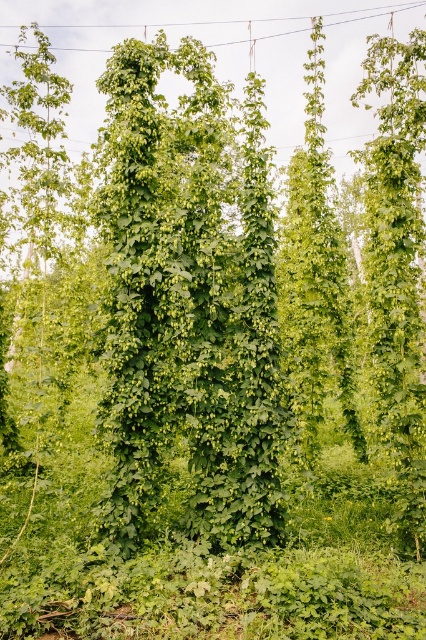
Question: Which of the following is the farthest from the observer?

Choices:
 (A) (236, 518)
 (B) (121, 24)

Answer: (B)

Question: Which object is closer to the camera taking this photo?

Choices:
 (A) green leafy plant at center
 (B) metallic wire at upper center

Answer: (A)

Question: Does green leafy plant at center appear on the right side of metallic wire at upper center?

Choices:
 (A) no
 (B) yes

Answer: (A)

Question: Which of the following is the closest to the observer?

Choices:
 (A) green leafy plant at center
 (B) metallic wire at upper center

Answer: (A)

Question: Does green leafy plant at center appear on the right side of metallic wire at upper center?

Choices:
 (A) no
 (B) yes

Answer: (A)

Question: Does green leafy plant at center have a greater width compared to metallic wire at upper center?

Choices:
 (A) yes
 (B) no

Answer: (B)